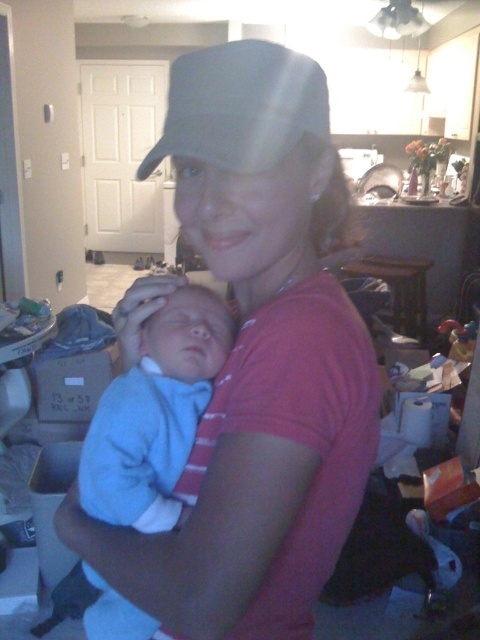
You are a photographer trying to capture a closeup of the gray fabric baseball cap at upper center without the light blue soft fabric newborn at center blocking the view. Can you adjust your position to do so?

The light blue soft fabric newborn at center is closer to the viewer than the gray fabric baseball cap at upper center, so moving your position slightly to the side or adjusting the angle might allow you to capture the cap without obstruction.